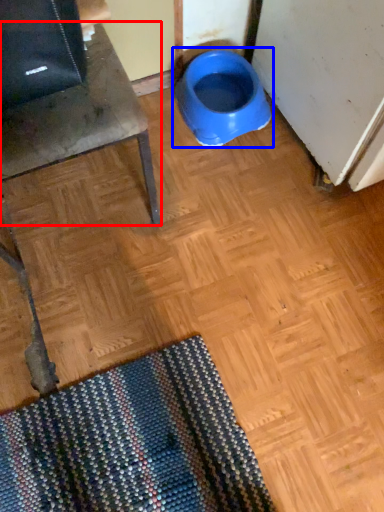
Question: Which object appears farthest to the camera in this image, furniture (highlighted by a red box) or toilet (highlighted by a blue box)?

Choices:
 (A) furniture
 (B) toilet

Answer: (B)